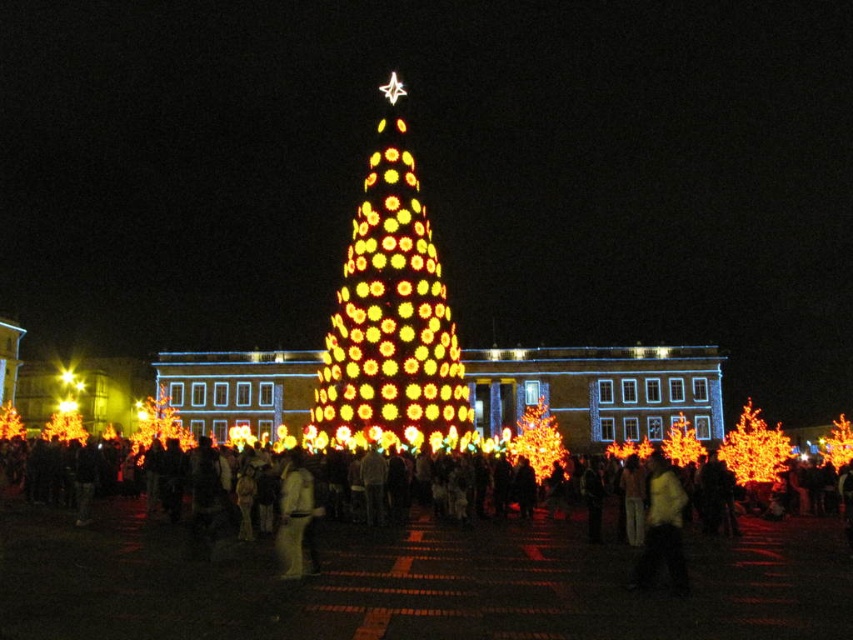
Measure the distance between yellow fabric jacket at center and light beige sweater at center.

They are 76.16 feet apart.

Between yellow fabric jacket at center and light beige sweater at center, which one has more height?

yellow fabric jacket at center is taller.

Is point (680, 490) more distant than point (299, 552)?

Yes, it is.

You are a GUI agent. You are given a task and a screenshot of the screen. Output one action in this format:
    pyautogui.click(x=<x>, y=<y>)
    Task: Click on the yellow fabric jacket at center
    
    Given the screenshot: What is the action you would take?
    pyautogui.click(x=662, y=528)

Does point (479, 480) come closer to viewer compared to point (659, 547)?

That is False.

Is white cotton shirt at center smaller than yellow fabric jacket at center?

Actually, white cotton shirt at center might be larger than yellow fabric jacket at center.

Is point (146, 497) in front of point (682, 502)?

No, (146, 497) is further to viewer.

What are the coordinates of `white cotton shirt at center` in the screenshot? It's located at (82, 461).

Between point (518, 422) and point (167, 432), which one is positioned in front?

Point (167, 432)

Is illuminated plastic tree at center thinner than illuminated orange lights at center?

Yes, illuminated plastic tree at center is thinner than illuminated orange lights at center.

Image resolution: width=853 pixels, height=640 pixels. I want to click on illuminated plastic tree at center, so click(x=537, y=440).